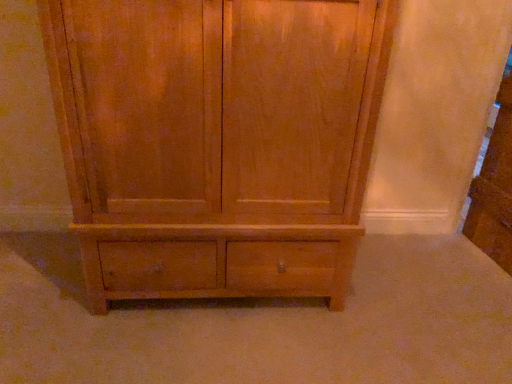
Describe the element at coordinates (217, 141) in the screenshot. I see `light brown wood chest of drawers at center` at that location.

I want to click on light brown wood chest of drawers at center, so click(x=217, y=141).

Where is `light brown wood chest of drawers at center`? light brown wood chest of drawers at center is located at coordinates (217, 141).